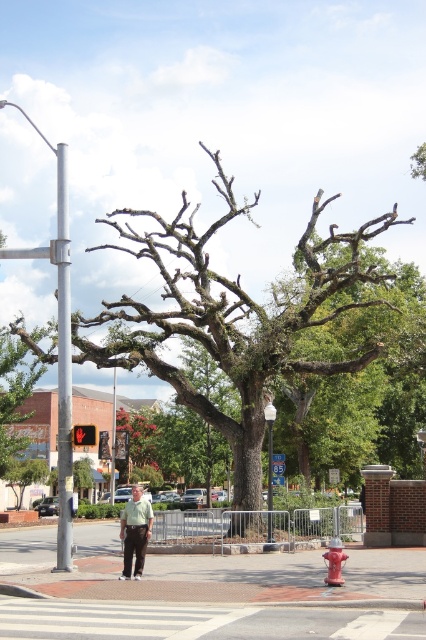
You are a delivery driver who needs to park your car in the street scene shown. You see the white asphalt at center and the red matte fire hydrant at lower right. Which area can you safely park your car without blocking the fire hydrant?

The white asphalt at center is larger in size than the red matte fire hydrant at lower right, so parking on the white asphalt at center would provide enough space to avoid blocking the fire hydrant.

You are a delivery person trying to determine the best path to deliver a package. You see the white asphalt at center and the light green shirt at center. Which area should you avoid stepping on to ensure the package stays clean?

You should avoid stepping on the white asphalt at center because it occupies less space than the light green shirt at center, making it more likely to be a smaller area prone to debris or dirt.

You are a drone operator trying to capture aerial footage of the street scene. You have two points marked on your map, point A at coordinates point(62, 625) and point B at coordinates point(140, 506). Which point should you choose to get a better view of the tree in the center?

Point point(62, 625) is closer to the viewer than point point(140, 506), so choosing point A will provide a better view of the tree in the center.